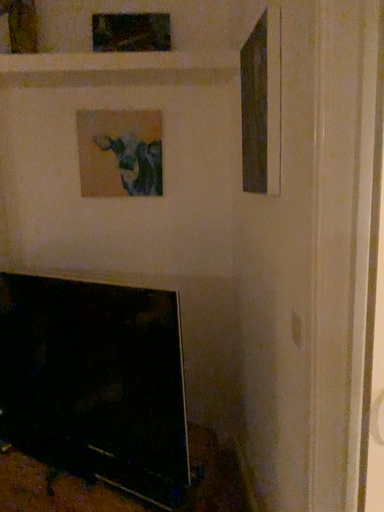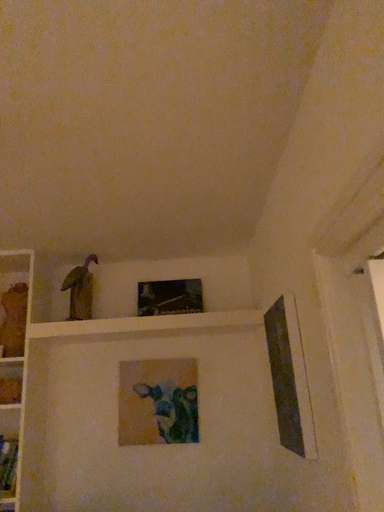
Question: Which way did the camera rotate in the video?

Choices:
 (A) rotated upward
 (B) rotated downward

Answer: (A)